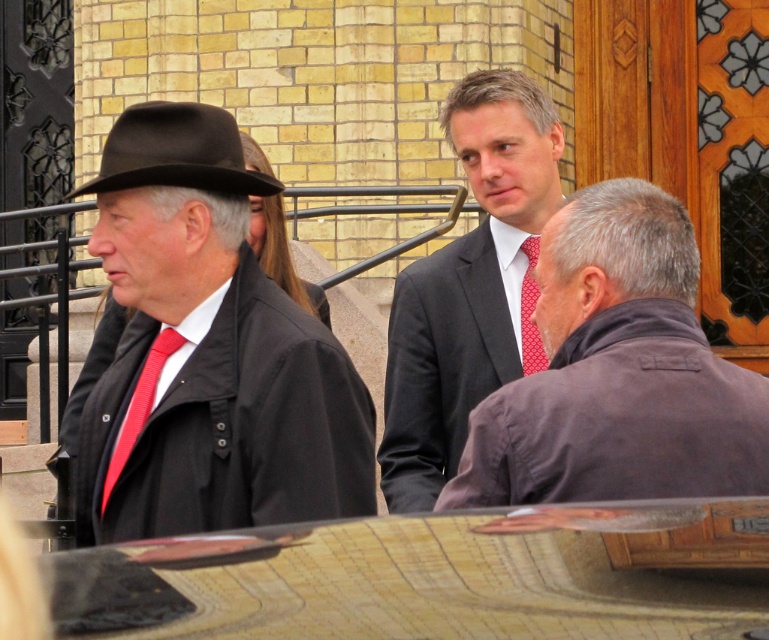
Question: Among these points, which one is farthest from the camera?

Choices:
 (A) (131, 396)
 (B) (125, 147)
 (C) (661, 320)

Answer: (A)

Question: Is dark gray suit at center positioned in front of black felt fedora at left?

Choices:
 (A) yes
 (B) no

Answer: (B)

Question: Does red textured tie at left appear on the right side of red dotted fabric tie at center?

Choices:
 (A) no
 (B) yes

Answer: (A)

Question: Can you confirm if matte black hat at left is smaller than dark gray suit at center?

Choices:
 (A) yes
 (B) no

Answer: (B)

Question: Which of the following is the closest to the observer?

Choices:
 (A) matte black hat at left
 (B) red dotted fabric tie at center
 (C) red textured tie at left

Answer: (A)

Question: Among these objects, which one is farthest from the camera?

Choices:
 (A) red textured tie at left
 (B) dark brown leather jacket at center

Answer: (A)